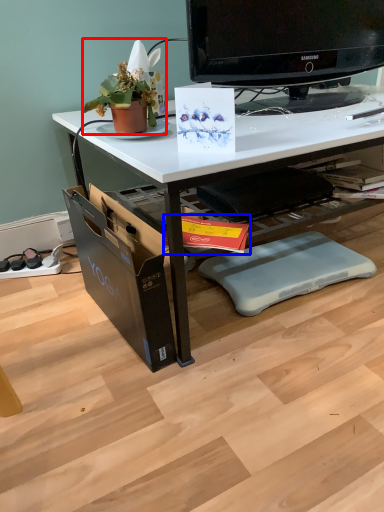
Question: Which point is further to the camera, houseplant (highlighted by a red box) or magazine (highlighted by a blue box)?

Choices:
 (A) houseplant
 (B) magazine

Answer: (A)